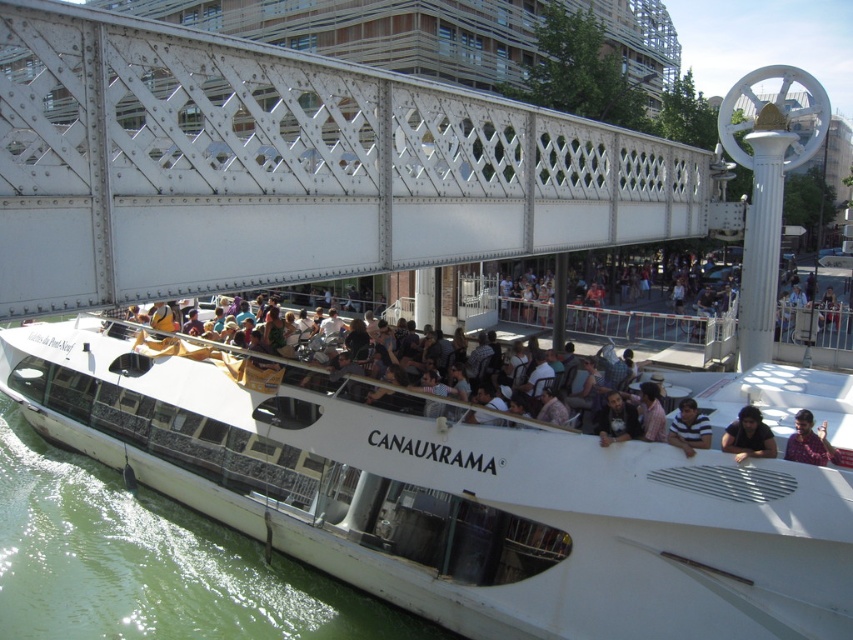
You are a photographer standing on the bridge and want to capture a photo of the passengers on the boat. You notice two specific features in your viewfinder. The first is the dark gray fabric at lower right and the second is the dark brown hair at upper right. Which of these two features is closer to the left edge of your viewfinder?

The dark gray fabric at lower right is positioned on the left side of the dark brown hair at upper right, so the dark gray fabric at lower right is closer to the left edge of the viewfinder.

You are a photographer standing on the bridge above the canal cruise boat Canauxrama. You want to take a photo of the passengers wearing the dark brown leather jacket at center and the person with dark brown hair at upper right. Which passenger should you focus on first to capture both in the frame?

The dark brown hair at upper right is to the right of the dark brown leather jacket at center, so you should focus on the dark brown leather jacket at center first to ensure both are in the frame.